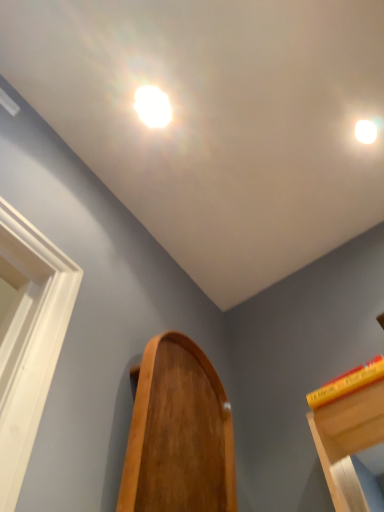
Question: From the image's perspective, is white glossy droplight at upper right, marked as the second droplight in a left-to-right arrangement, under yellow matte book at upper right?

Choices:
 (A) yes
 (B) no

Answer: (B)

Question: Is white glossy droplight at upper right, which is counted as the first droplight, starting from the back, wider than yellow matte book at upper right?

Choices:
 (A) no
 (B) yes

Answer: (A)

Question: Considering the relative positions of white glossy droplight at upper right, which is counted as the first droplight, starting from the back, and yellow matte book at upper right in the image provided, is white glossy droplight at upper right, which is counted as the first droplight, starting from the back, to the right of yellow matte book at upper right from the viewer's perspective?

Choices:
 (A) no
 (B) yes

Answer: (B)

Question: From the image's perspective, is white glossy droplight at upper right, placed as the 2th droplight when sorted from front to back, on top of yellow matte book at upper right?

Choices:
 (A) yes
 (B) no

Answer: (A)

Question: Is white glossy droplight at upper right, marked as the second droplight in a left-to-right arrangement, aimed at yellow matte book at upper right?

Choices:
 (A) yes
 (B) no

Answer: (B)

Question: Considering the positions of white glossy droplight at upper right, placed as the 2th droplight when sorted from front to back, and wooden mirror at center in the image, is white glossy droplight at upper right, placed as the 2th droplight when sorted from front to back, taller or shorter than wooden mirror at center?

Choices:
 (A) short
 (B) tall

Answer: (A)

Question: Based on their positions, is white glossy droplight at upper right, placed as the 2th droplight when sorted from front to back, located to the left or right of wooden mirror at center?

Choices:
 (A) left
 (B) right

Answer: (B)

Question: In the image, is white glossy droplight at upper right, which is counted as the first droplight, starting from the back, positioned in front of or behind wooden mirror at center?

Choices:
 (A) behind
 (B) front

Answer: (A)

Question: Is point (367, 135) closer or farther from the camera than point (180, 504)?

Choices:
 (A) farther
 (B) closer

Answer: (A)

Question: From the image's perspective, relative to yellow matte book at upper right, is wooden mirror at center above or below?

Choices:
 (A) above
 (B) below

Answer: (B)

Question: From a real-world perspective, is wooden mirror at center physically located above or below yellow matte book at upper right?

Choices:
 (A) above
 (B) below

Answer: (B)

Question: From their relative heights in the image, would you say wooden mirror at center is taller or shorter than yellow matte book at upper right?

Choices:
 (A) tall
 (B) short

Answer: (A)

Question: Considering their positions, is wooden mirror at center located in front of or behind yellow matte book at upper right?

Choices:
 (A) front
 (B) behind

Answer: (A)

Question: From a real-world perspective, is wooden mirror at center physically located above or below white glossy droplight at upper right, marked as the second droplight in a left-to-right arrangement?

Choices:
 (A) above
 (B) below

Answer: (B)

Question: Is wooden mirror at center to the left or to the right of white glossy droplight at upper right, placed as the 2th droplight when sorted from front to back, in the image?

Choices:
 (A) right
 (B) left

Answer: (B)